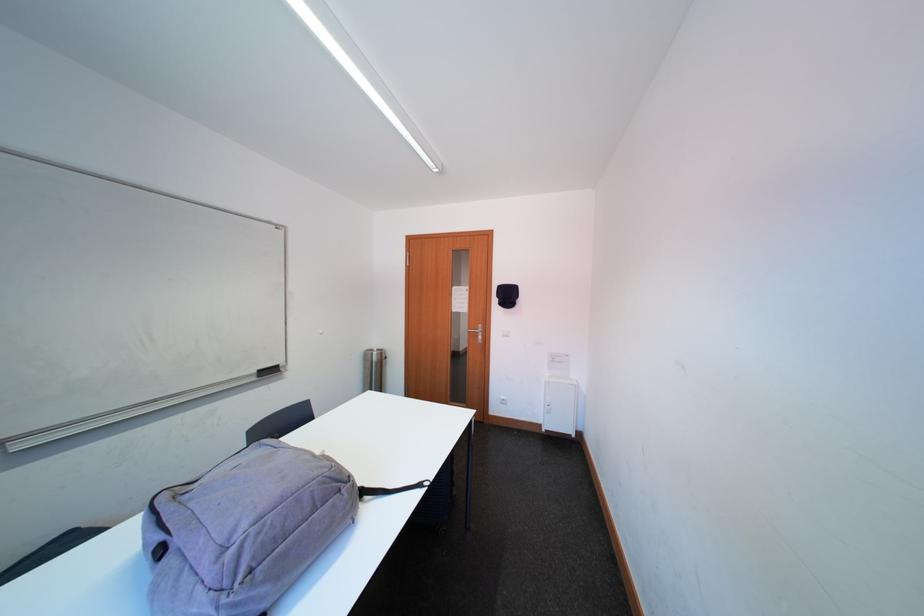
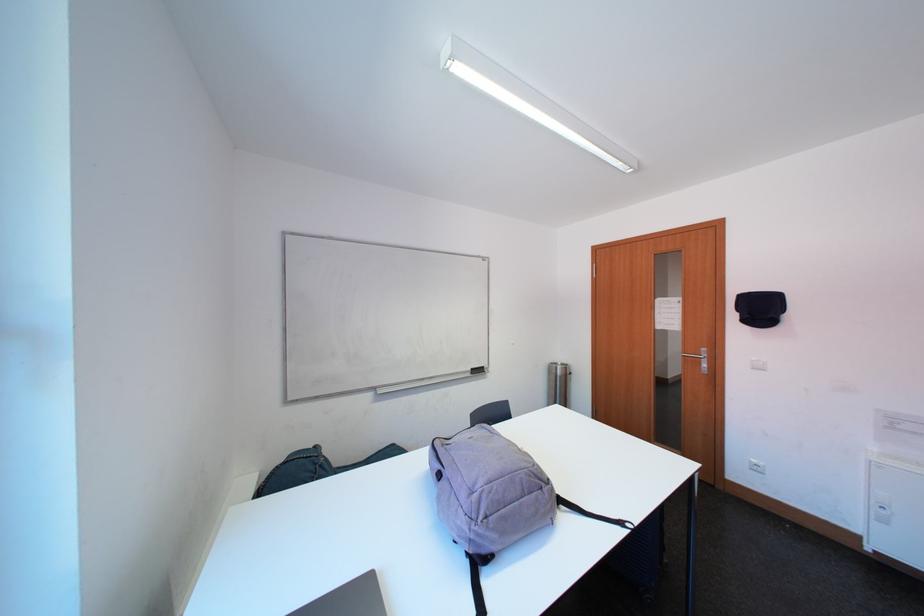
The point at (x=382, y=358) is marked in the first image. Where is the corresponding point in the second image?

(565, 371)